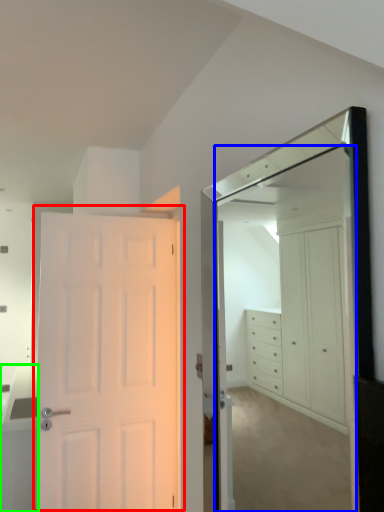
Question: Which is farther away from door (highlighted by a red box)? mirror (highlighted by a blue box) or cabinetry (highlighted by a green box)?

Choices:
 (A) mirror
 (B) cabinetry

Answer: (A)